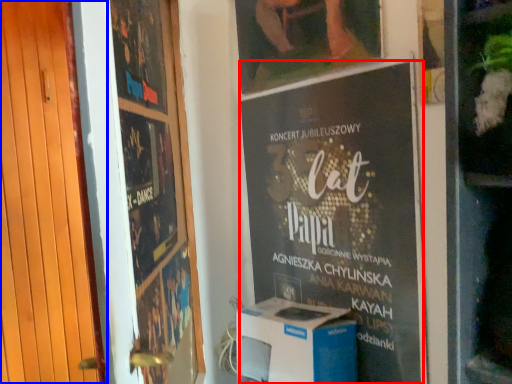
Question: Which object appears farthest to the camera in this image, poster (highlighted by a red box) or door (highlighted by a blue box)?

Choices:
 (A) poster
 (B) door

Answer: (A)